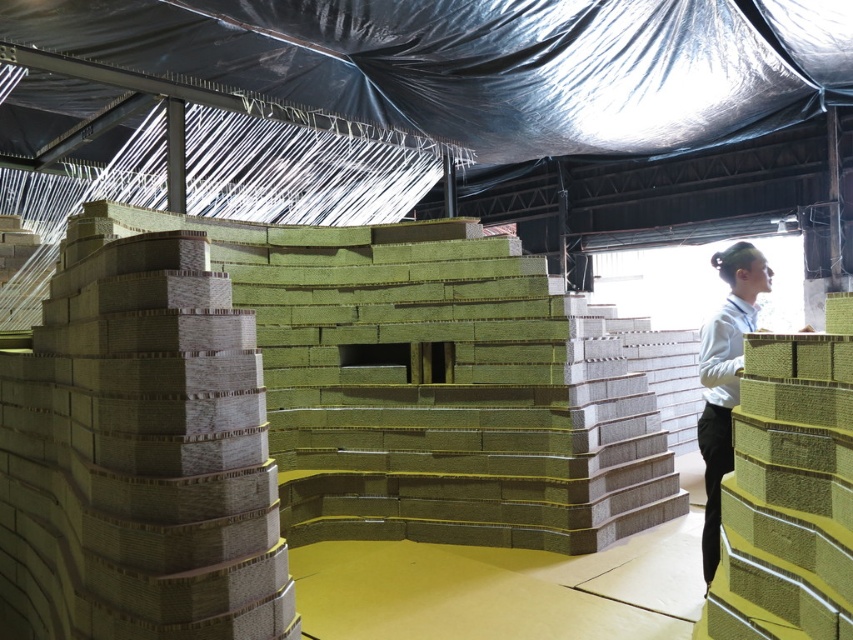
Question: Which object is closer to the camera taking this photo?

Choices:
 (A) matte cardboard stack at left
 (B) matte olive-green cardboard at right

Answer: (A)

Question: Is matte cardboard stack at left bigger than matte olive-green cardboard at right?

Choices:
 (A) no
 (B) yes

Answer: (B)

Question: Is matte cardboard stack at left thinner than matte olive-green cardboard at right?

Choices:
 (A) no
 (B) yes

Answer: (A)

Question: Which object appears closest to the camera in this image?

Choices:
 (A) matte cardboard stack at left
 (B) matte olive-green cardboard at right

Answer: (A)

Question: Observing the image, what is the correct spatial positioning of matte cardboard stack at left in reference to matte olive-green cardboard at right?

Choices:
 (A) right
 (B) left

Answer: (B)